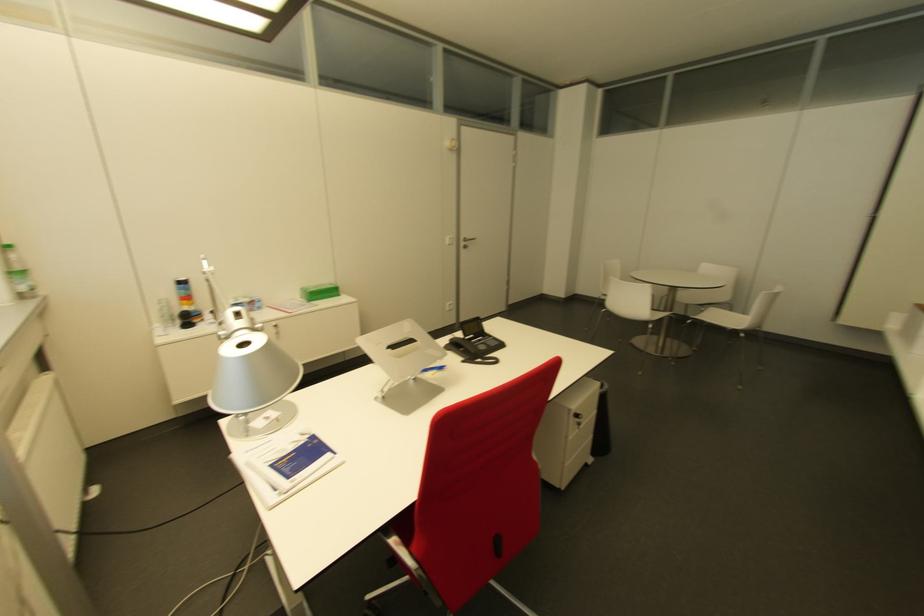
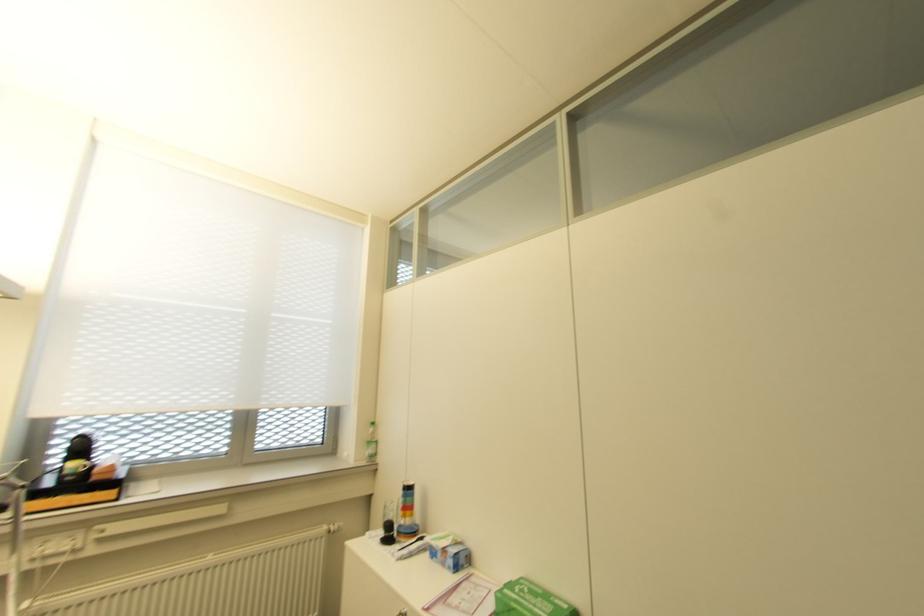
Where in the second image is the point corresponding to point 186,325 from the first image?

(385, 540)